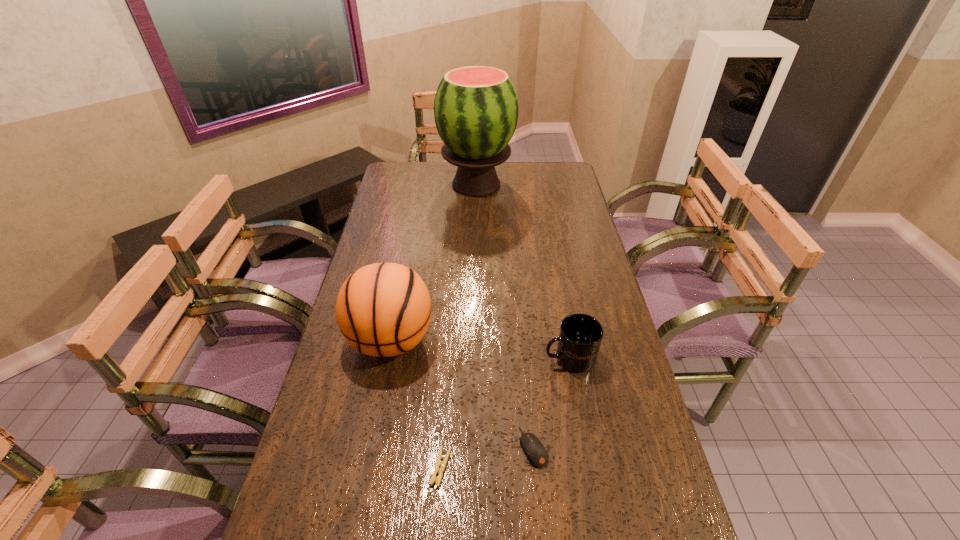
Where is `vacant space located 0.360m with the handle on the side of the third tallest object`? The image size is (960, 540). vacant space located 0.360m with the handle on the side of the third tallest object is located at coordinates (414, 357).

The image size is (960, 540). What are the coordinates of `free spot located with the handle on the side of the third tallest object` in the screenshot? It's located at (518, 357).

Where is `vacant position located 0.090m on the front of the second shortest object`? The width and height of the screenshot is (960, 540). vacant position located 0.090m on the front of the second shortest object is located at coordinates (540, 510).

The width and height of the screenshot is (960, 540). Identify the location of blank space located 0.140m on the left of the clothespin. pos(370,467).

I want to click on object positioned at the far edge, so click(476, 108).

This screenshot has width=960, height=540. I want to click on object that is at the left edge, so (383, 309).

The width and height of the screenshot is (960, 540). What are the coordinates of `object at the right edge` in the screenshot? It's located at (580, 335).

I want to click on vacant space at the far edge of the desktop, so click(x=442, y=185).

In the image, there is a desktop. Identify the location of free space at the left edge. (385, 229).

Identify the location of free space at the right edge of the desktop. (579, 197).